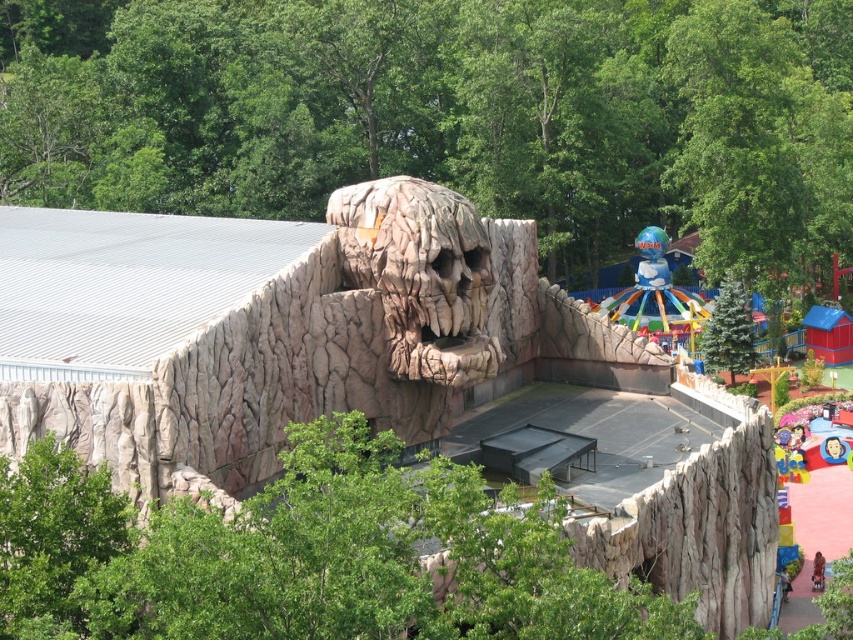
Question: Which of the following is the farthest from the observer?

Choices:
 (A) (717, 358)
 (B) (364, 259)

Answer: (A)

Question: Which object is positioned farthest from the green textured pine tree at center right?

Choices:
 (A) multicolored plastic carousel at center
 (B) rough stone skull at center

Answer: (B)

Question: Is multicolored plastic carousel at center in front of green textured pine tree at center right?

Choices:
 (A) no
 (B) yes

Answer: (A)

Question: Which point is closer to the camera?

Choices:
 (A) rough stone skull at center
 (B) multicolored plastic carousel at center
 (C) green textured pine tree at center right

Answer: (A)

Question: Is rough stone skull at center wider than green textured pine tree at center right?

Choices:
 (A) no
 (B) yes

Answer: (B)

Question: In this image, where is multicolored plastic carousel at center located relative to green textured pine tree at center right?

Choices:
 (A) below
 (B) above

Answer: (B)